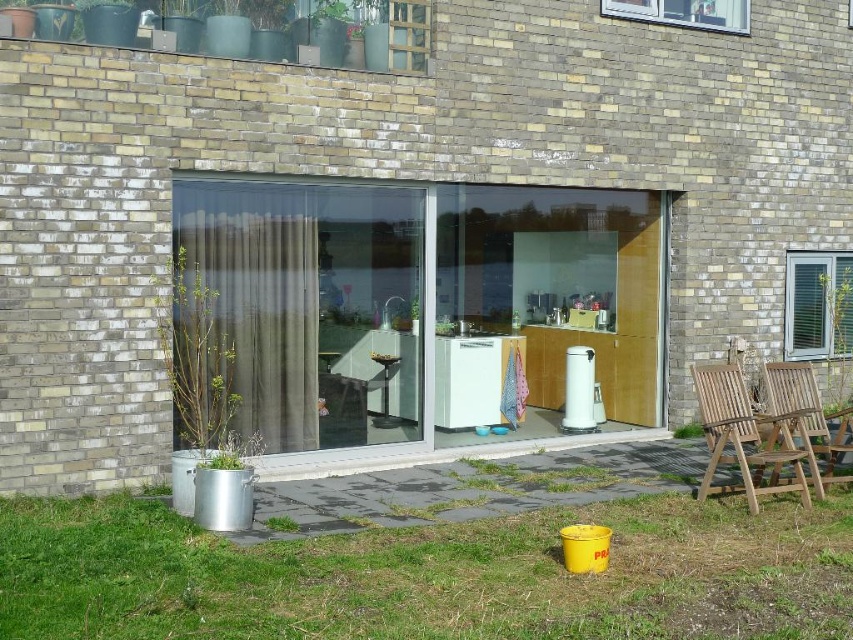
Measure the distance from teak wood chair at lower right to metallic silver stool at center.

A distance of 12.27 feet exists between teak wood chair at lower right and metallic silver stool at center.

Between teak wood chair at lower right and metallic silver stool at center, which one appears on the right side from the viewer's perspective?

Positioned to the right is teak wood chair at lower right.

Describe the element at coordinates (805, 417) in the screenshot. This screenshot has width=853, height=640. I see `teak wood chair at lower right` at that location.

This screenshot has width=853, height=640. Identify the location of teak wood chair at lower right. (805, 417).

Between transparent glass door at center and teak wood chairs at lower right, which one is positioned higher?

Positioned higher is transparent glass door at center.

Is transparent glass door at center above teak wood chairs at lower right?

Indeed, transparent glass door at center is positioned over teak wood chairs at lower right.

Is point (341, 289) positioned in front of point (730, 404)?

No, (341, 289) is behind (730, 404).

Identify the location of transparent glass door at center. The width and height of the screenshot is (853, 640). (311, 304).

Who is taller, teak wood chairs at lower right or metallic silver stool at center?

teak wood chairs at lower right is taller.

Does teak wood chairs at lower right have a greater width compared to metallic silver stool at center?

Indeed, teak wood chairs at lower right has a greater width compared to metallic silver stool at center.

The height and width of the screenshot is (640, 853). What are the coordinates of `teak wood chairs at lower right` in the screenshot? It's located at (743, 436).